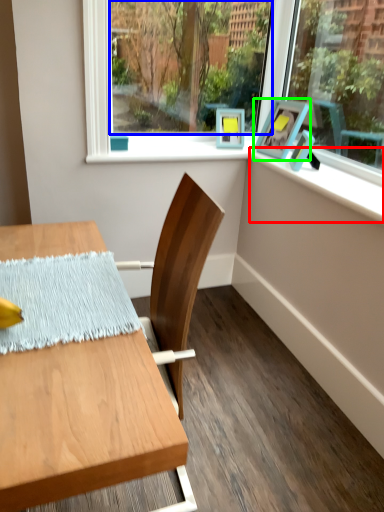
Question: Which object is the closest to the window sill (highlighted by a red box)? Choose among these: window screen (highlighted by a blue box) or picture frame (highlighted by a green box).

Choices:
 (A) window screen
 (B) picture frame

Answer: (B)